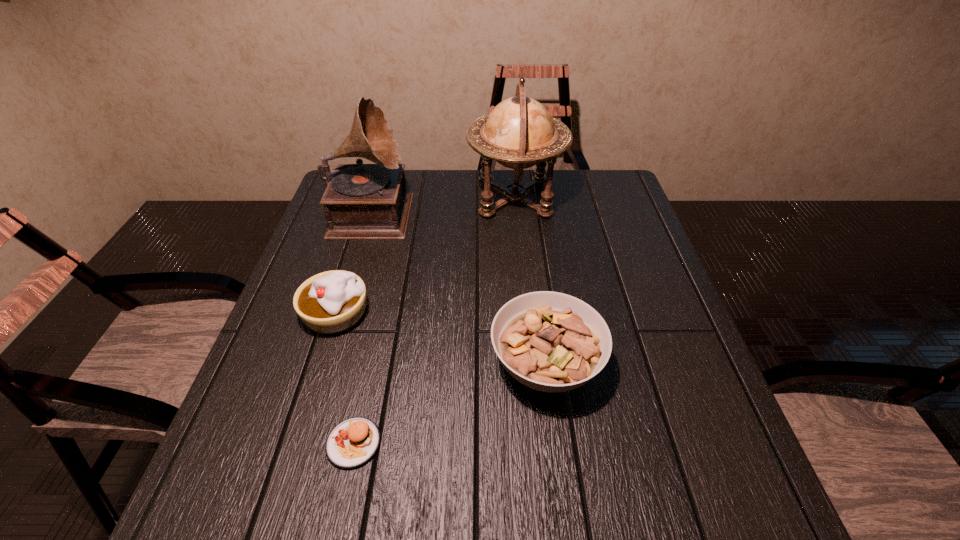
The width and height of the screenshot is (960, 540). I want to click on free space located on the right of the whipped cream, so click(x=417, y=313).

Where is `free space located on the left of the stew`? free space located on the left of the stew is located at coordinates (366, 365).

At what (x,y) coordinates should I click in order to perform the action: click on vacant space situated 0.260m on the back of the patty. Please return your answer as a coordinate pair (x, y). The height and width of the screenshot is (540, 960). Looking at the image, I should click on (381, 315).

You are a GUI agent. You are given a task and a screenshot of the screen. Output one action in this format:
    pyautogui.click(x=<x>, y=<y>)
    Task: Click on the globe located at the far edge
    This screenshot has width=960, height=540.
    Given the screenshot: What is the action you would take?
    pyautogui.click(x=519, y=132)

This screenshot has width=960, height=540. I want to click on record player located in the far edge section of the desktop, so click(362, 201).

Identify the location of record player that is at the left edge. (362, 201).

Image resolution: width=960 pixels, height=540 pixels. Find the location of `whipped cream that is at the left edge`. whipped cream that is at the left edge is located at coordinates (333, 301).

Image resolution: width=960 pixels, height=540 pixels. I want to click on object that is at the far left corner, so click(362, 201).

Locate an element on the screen. The height and width of the screenshot is (540, 960). free location at the far edge is located at coordinates (413, 180).

What are the coordinates of `free space at the near edge` in the screenshot? It's located at (439, 530).